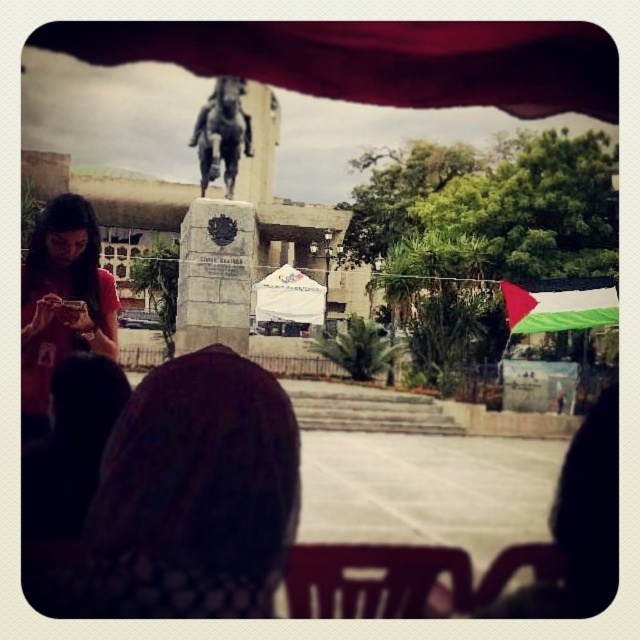
You are organizing a small event and need to place a 2.5 meter long table between the matte red umbrella at upper center and the matte red shirt at lower left. Is there enough space for the table to fit between them?

The distance between the matte red umbrella at upper center and the matte red shirt at lower left is 24.75 meters, so yes, there is enough space to place a 2.5 meter long table between them.

You are sitting under a red canopy and notice a matte red shirt at lower left and a bronze statue at center. Which object is closer to you from your seated perspective?

The matte red shirt at lower left is closer to you because it is positioned under the bronze statue at center, which places it nearer in your line of sight.

You are sitting under the red canopy and want to look at two points in the image. Which point is closer to you, point (36, 282) or point (189, 141)?

Point (36, 282) is in front of point (189, 141), so it is closer to you.